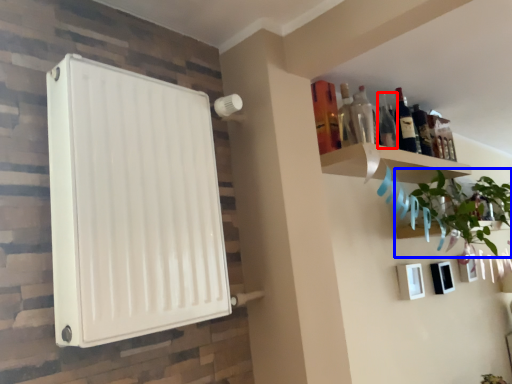
Question: Which point is closer to the camera, bottle (highlighted by a red box) or houseplant (highlighted by a blue box)?

Choices:
 (A) bottle
 (B) houseplant

Answer: (B)